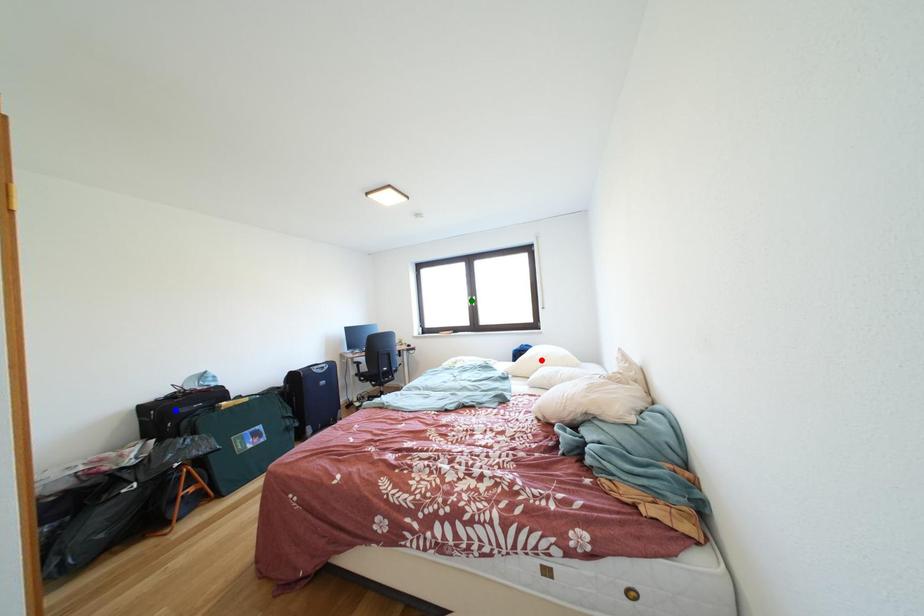
Order these from nearest to farthest:
blue point | red point | green point

blue point
red point
green point